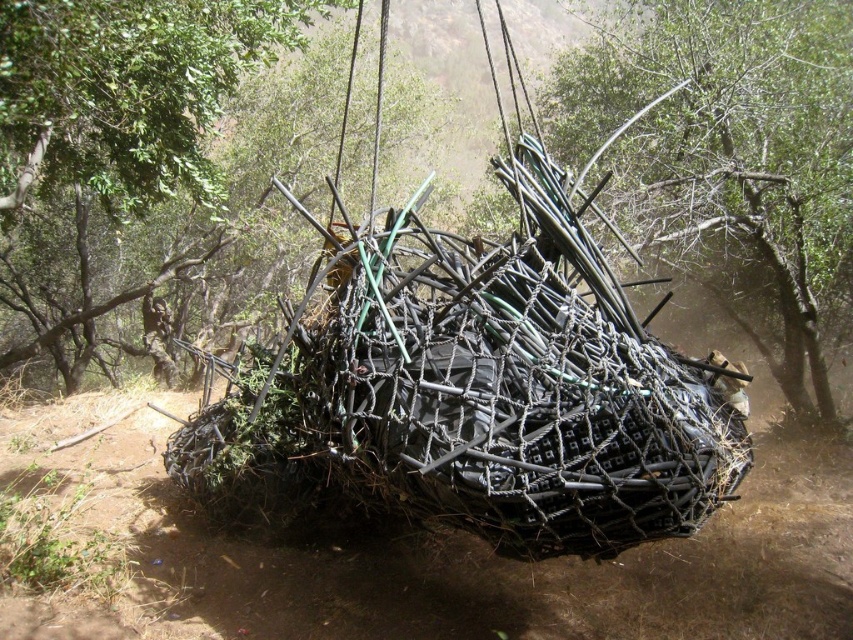
From the picture: You are a hiker who has just arrived at a crossroads in the woods. You see a brown dirt track at center and a green matte wire mesh at center. Which one is positioned to the right of the other?

The brown dirt track at center is to the right of green matte wire mesh at center.

You are a hiker trying to navigate through the wooded area. You see a brown dirt track at center and a green leafy tree at upper center. Which object is positioned higher in the image?

The green leafy tree at upper center is positioned higher in the image than the brown dirt track at center.